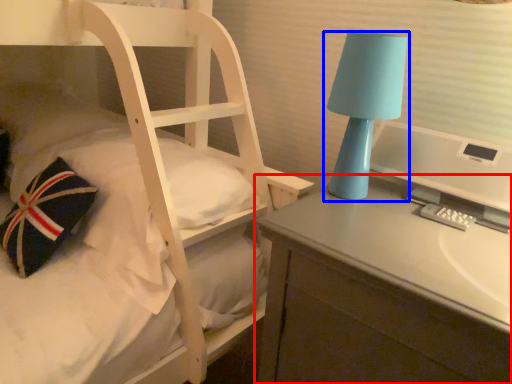
Question: Among these objects, which one is farthest to the camera, desk (highlighted by a red box) or lamp (highlighted by a blue box)?

Choices:
 (A) desk
 (B) lamp

Answer: (B)